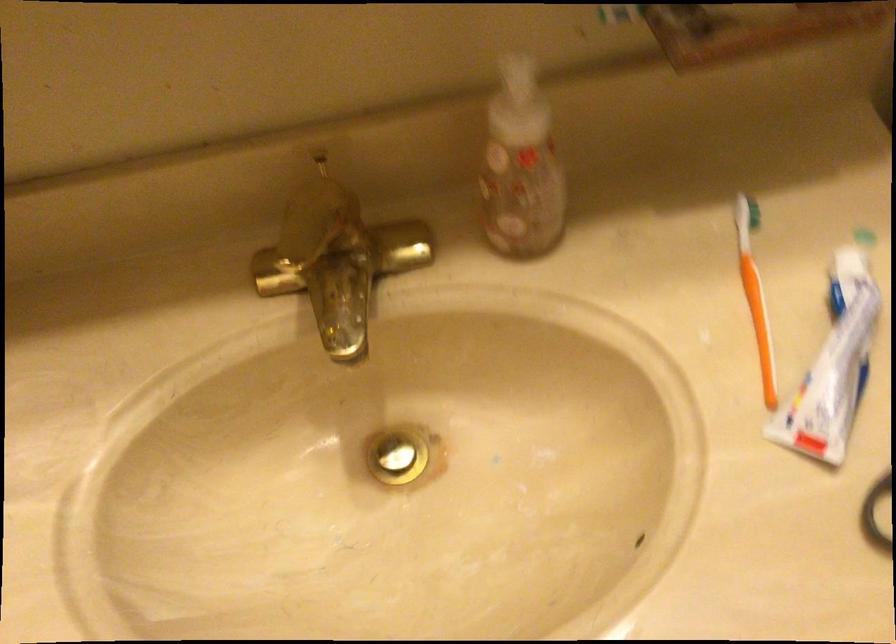
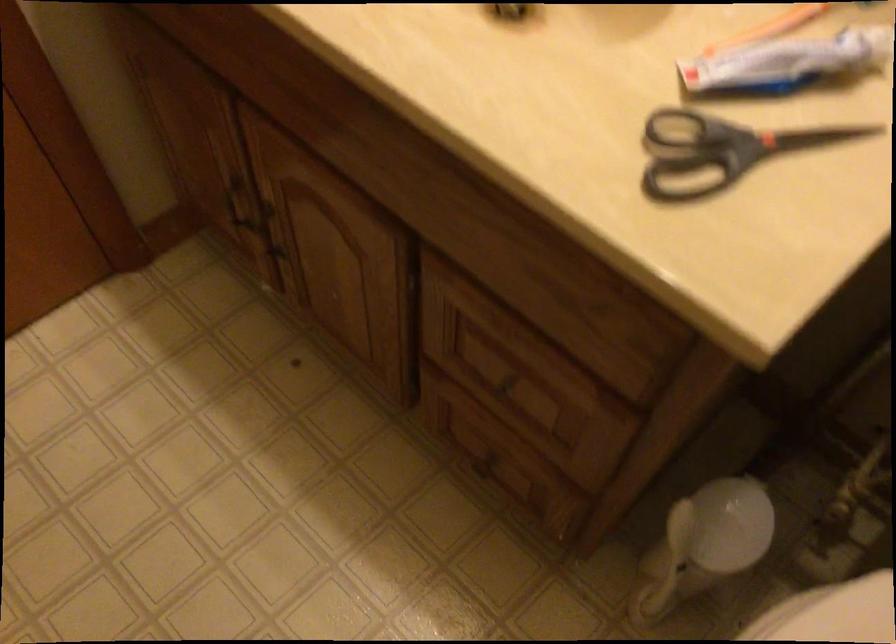
Question: The camera is either moving clockwise (left) or counter-clockwise (right) around the object. The first image is from the beginning of the video and the second image is from the end. Is the camera moving left or right when shooting the video?

Choices:
 (A) Left
 (B) Right

Answer: (B)